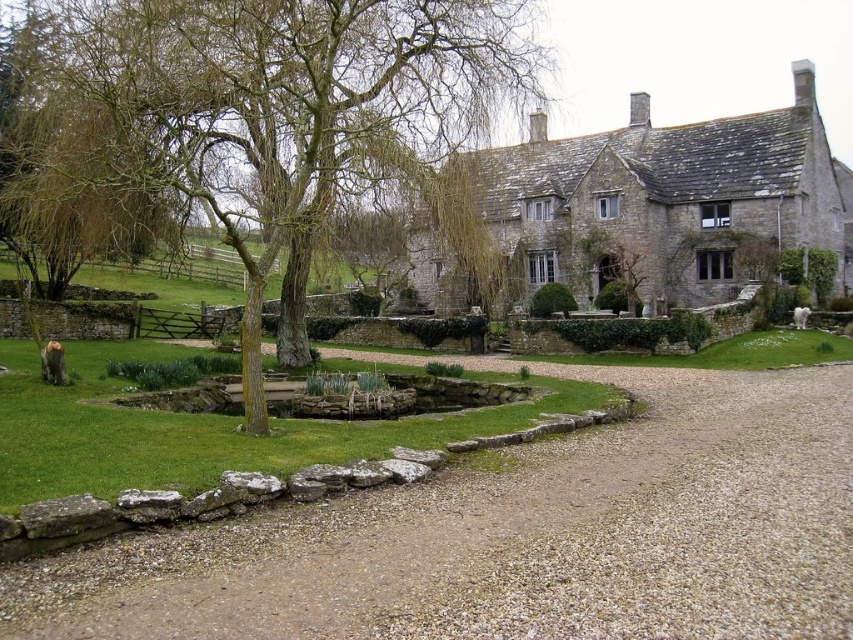
You are standing at the entrance of the stone house and see the green leafy tree at upper left and the white fluffy dog at lower right. Which object is taller?

The green leafy tree at upper left is much taller than the white fluffy dog at lower right.

You are standing at the entrance of the stone house and want to reach the pond. According to the image, which direction should you walk relative to the gray gravel at center?

Since the gray gravel at center is located at point (518, 538), you should walk towards the lower left direction to reach the pond from the entrance of the stone house.